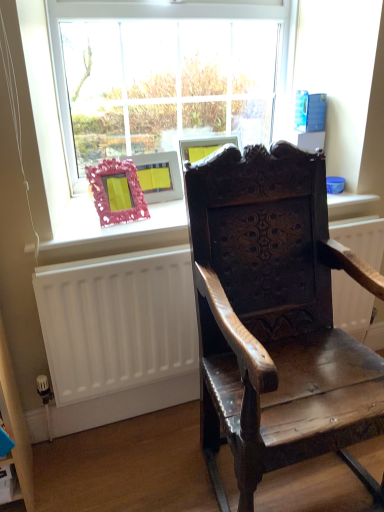
Question: In the image, is clear glass window at upper center positioned in front of or behind pink textured frame at window?

Choices:
 (A) behind
 (B) front

Answer: (A)

Question: Is clear glass window at upper center taller or shorter than pink textured frame at window?

Choices:
 (A) short
 (B) tall

Answer: (B)

Question: Considering the real-world distances, which object is farthest from the clear glass window at upper center?

Choices:
 (A) white matte radiator at lower left
 (B) pink textured frame at window
 (C) dark wood carved chair at center
 (D) wooden frame at upper center

Answer: (C)

Question: Which object is the farthest from the clear glass window at upper center?

Choices:
 (A) pink textured frame at window
 (B) white matte radiator at lower left
 (C) wooden frame at upper center
 (D) dark wood carved chair at center

Answer: (D)